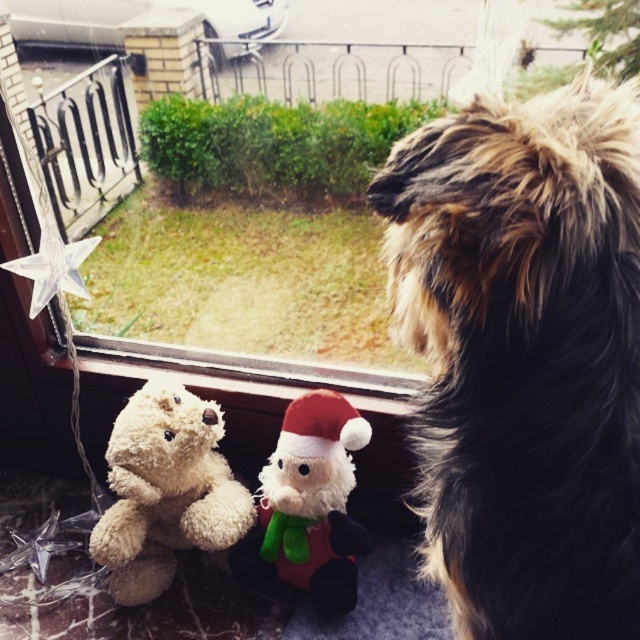
Question: Estimate the real-world distances between objects in this image. Which object is farther from the soft beige teddy bear at lower left?

Choices:
 (A) velvety plush santa at center
 (B) white plush at center

Answer: (B)

Question: Which point appears farthest from the camera in this image?

Choices:
 (A) [x=364, y=385]
 (B) [x=416, y=422]
 (C) [x=163, y=538]

Answer: (A)

Question: Is black fluffy dog at right to the right of white plush at center from the viewer's perspective?

Choices:
 (A) no
 (B) yes

Answer: (B)

Question: Is black fluffy dog at right smaller than soft beige teddy bear at lower left?

Choices:
 (A) no
 (B) yes

Answer: (A)

Question: Does black fluffy dog at right have a larger size compared to velvety plush santa at center?

Choices:
 (A) yes
 (B) no

Answer: (A)

Question: Which is farther from the velvety plush santa at center?

Choices:
 (A) white plush at center
 (B) soft beige teddy bear at lower left
 (C) black fluffy dog at right

Answer: (C)